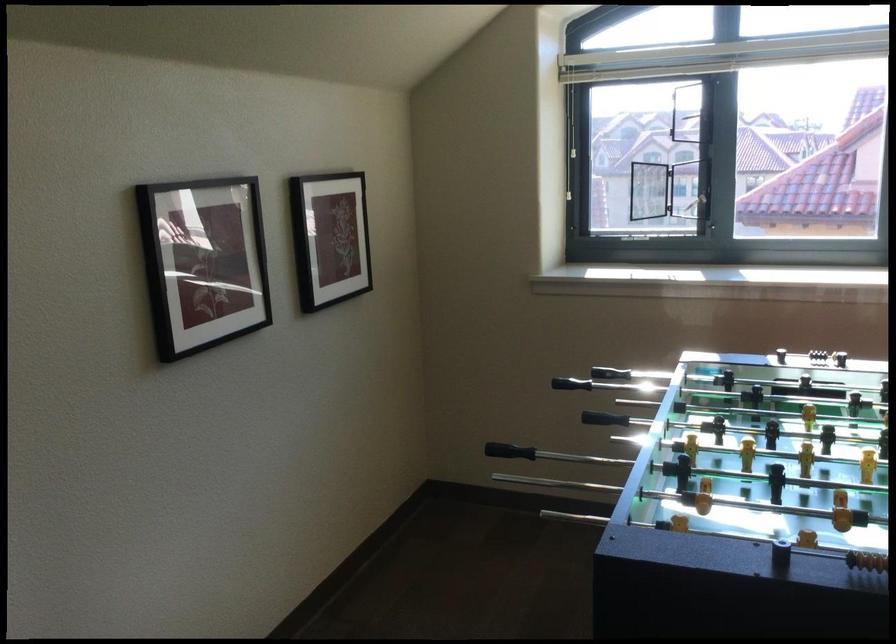
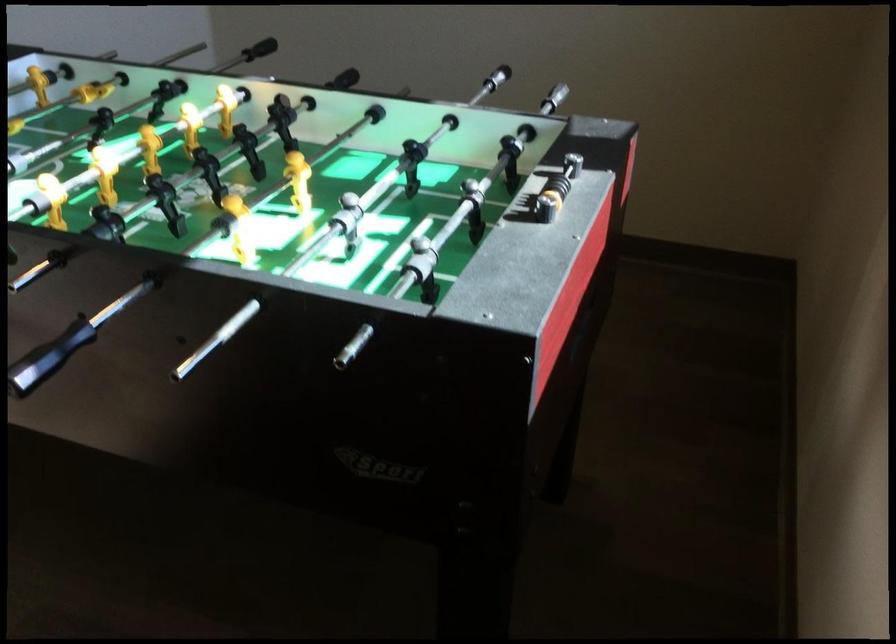
Where in the second image is the point corresponding to point 302,453 from the first image?

(496, 78)